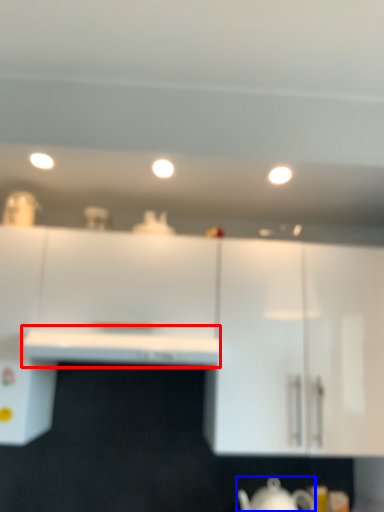
Question: Which object is further to the camera taking this photo, counter top (highlighted by a red box) or jug (highlighted by a blue box)?

Choices:
 (A) counter top
 (B) jug

Answer: (B)